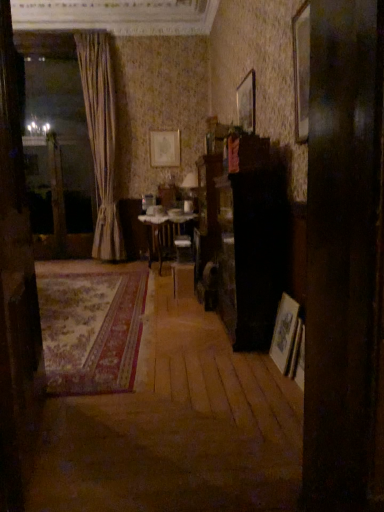
Question: From the image's perspective, is wooden floor at center above or below wooden picture frame at right, which is counted as the third picture frame, starting from the back?

Choices:
 (A) below
 (B) above

Answer: (A)

Question: Based on their positions, is wooden floor at center located to the left or right of wooden picture frame at right, the 1th picture frame in the front-to-back sequence?

Choices:
 (A) left
 (B) right

Answer: (A)

Question: Estimate the real-world distances between objects in this image. Which object is farther from the carpeted rug at center?

Choices:
 (A) wooden picture frame at upper right, which is counted as the 2th picture frame, starting from the top
 (B) wooden table at center
 (C) wooden door at left
 (D) beige fabric curtain at left
 (E) matte gold picture frame at upper center, arranged as the third picture frame when viewed from the right

Answer: (A)

Question: Based on their relative distances, which object is farther from the wooden door at left?

Choices:
 (A) beige fabric curtain at left
 (B) carpeted rug at center
 (C) wooden picture frame at right, the 3th picture frame in the top-to-bottom sequence
 (D) wooden table at center
 (E) matte gold picture frame at upper center, which is the third picture frame from front to back

Answer: (E)